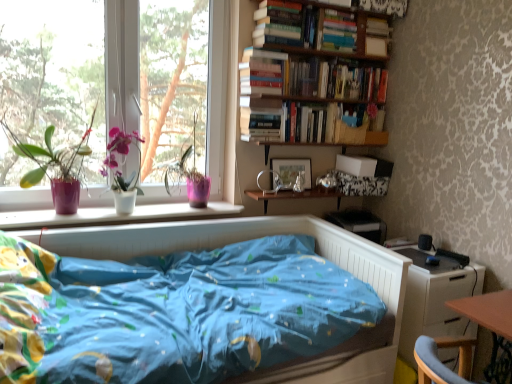
The height and width of the screenshot is (384, 512). Identify the location of vacant space underneath matte white pot at window (from a real-world perspective). (126, 211).